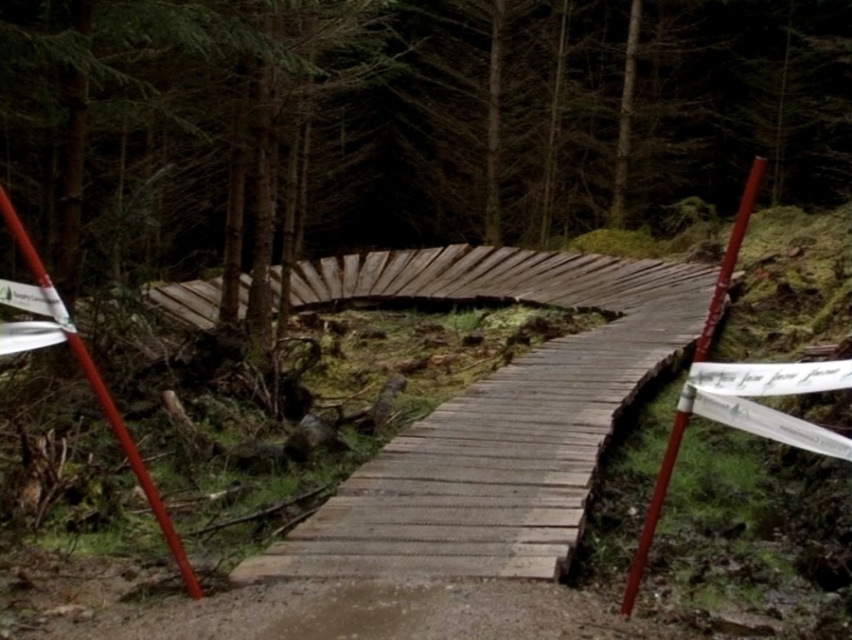
Which is behind, point (614, 417) or point (39, 278)?

Positioned behind is point (614, 417).

Can you confirm if wooden at center is taller than smooth red pole at left?

Yes.

Is point (469, 529) farther from viewer compared to point (27, 246)?

Yes, point (469, 529) is farther from viewer.

Identify the location of wooden at center. This screenshot has height=640, width=852. (504, 429).

Consider the image. Can you confirm if wooden at center is smaller than smooth red pole at right?

Correct, wooden at center occupies less space than smooth red pole at right.

Which is below, wooden at center or smooth red pole at right?

wooden at center

Who is more forward, (609, 356) or (660, 502)?

Positioned in front is point (660, 502).

The width and height of the screenshot is (852, 640). Find the location of `wooden at center`. wooden at center is located at coordinates (504, 429).

Is smooth red pole at left further to the viewer compared to smooth red pole at right?

Yes, it is behind smooth red pole at right.

Does smooth red pole at left have a greater height compared to smooth red pole at right?

No, smooth red pole at left is not taller than smooth red pole at right.

Does point (16, 220) come closer to viewer compared to point (646, 540)?

That is True.

Identify the location of smooth red pole at left. Image resolution: width=852 pixels, height=640 pixels. (85, 374).